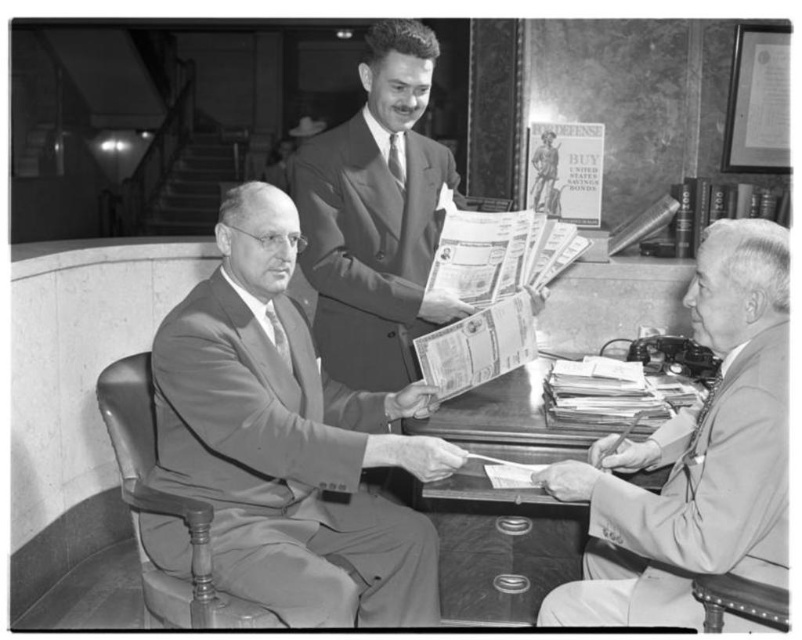
You are an interior designer assessing the office layout. The smooth gray suit at center and the wooden desk at center are both in the center of the room. Which object takes up more space in the room?

The smooth gray suit at center is bigger than the wooden desk at center, so it takes up more space in the room.

You are a delivery person who needs to place a package on the wooden desk at center. The package is 50 centimeters wide. Can you fit the package on the desk without moving the smooth suit at center?

The distance between the smooth suit at center and the wooden desk at center is 48.10 centimeters. Since the package is 50 centimeters wide, it is slightly wider than the available space. Therefore, the package cannot be placed on the desk without moving the smooth suit at center.

You are a tailor observing the two men in the image. Which man is wearing the larger suit, the one in the smooth gray suit at center or the one in the smooth beige suit at right?

The smooth gray suit at center is larger in size than the smooth beige suit at right, so the man wearing the smooth gray suit at center is the one with the larger suit.